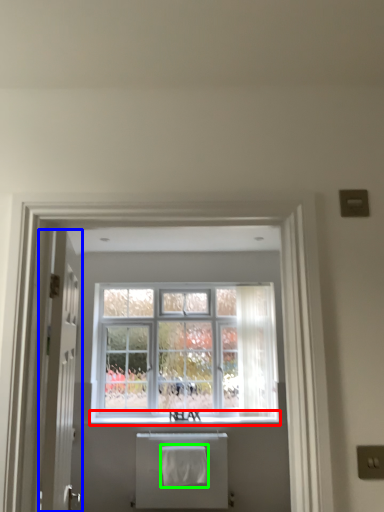
Question: Estimate the real-world distances between objects in this image. Which object is closer to window sill (highlighted by a red box), door (highlighted by a blue box) or bath towel (highlighted by a green box)?

Choices:
 (A) door
 (B) bath towel

Answer: (B)